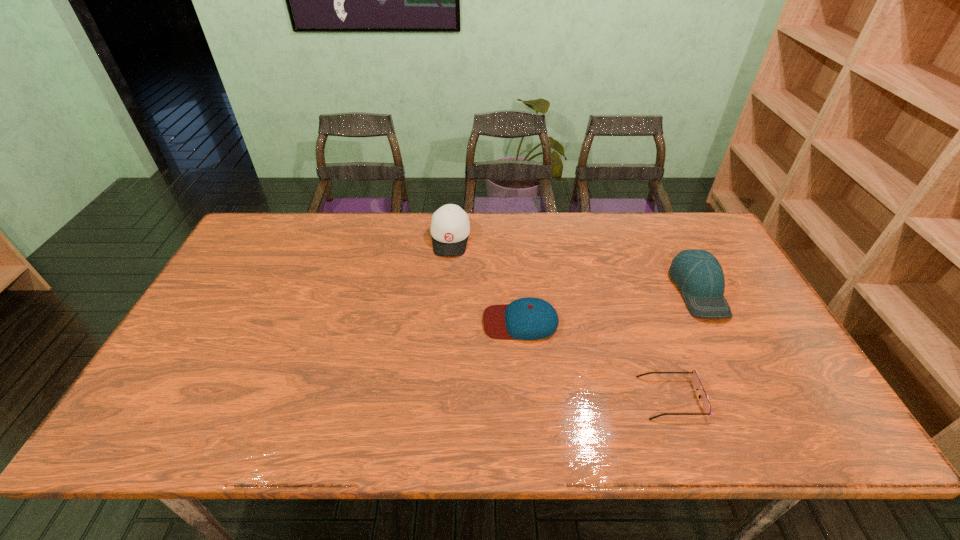
Where is `vacant space that satisfies the following two spatial constraints: 1. on the front-facing side of the rightmost baseball cap; 2. on the left side of the farthest object`? vacant space that satisfies the following two spatial constraints: 1. on the front-facing side of the rightmost baseball cap; 2. on the left side of the farthest object is located at coordinates (446, 289).

Identify the location of vacant space that satisfies the following two spatial constraints: 1. on the front side of the rightmost baseball cap; 2. with the bill of the third tallest object facing forward. This screenshot has height=540, width=960. (714, 322).

Locate an element on the screen. free space that satisfies the following two spatial constraints: 1. on the front side of the rightmost object; 2. on the bridge of the sunglasses is located at coordinates (754, 397).